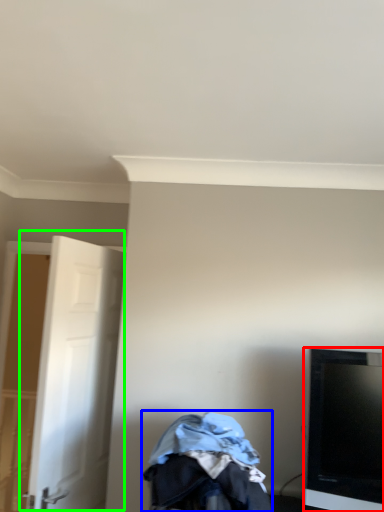
Question: Estimate the real-world distances between objects in this image. Which object is farther from television (highlighted by a red box), baby carriage (highlighted by a blue box) or door (highlighted by a green box)?

Choices:
 (A) baby carriage
 (B) door

Answer: (B)